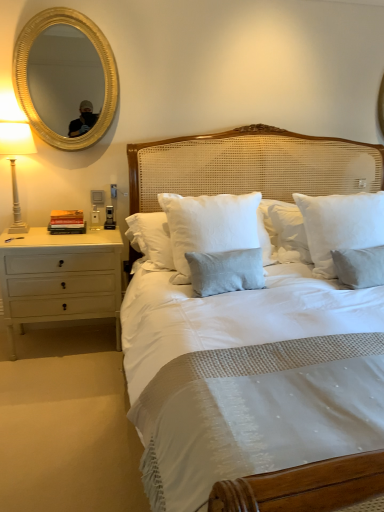
Where is `vacant area situated below white ceramic lamp at left (from a real-world perspective)`? Image resolution: width=384 pixels, height=512 pixels. vacant area situated below white ceramic lamp at left (from a real-world perspective) is located at coordinates (31, 232).